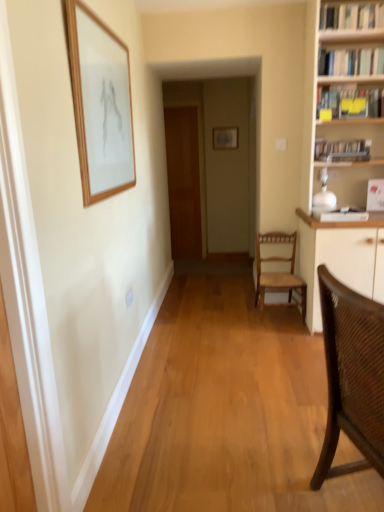
Question: Does hardcover books at upper right, positioned as the fourth book in top-to-bottom order, appear on the left side of brown woven chair at right, which ranks as the 1th chair in front-to-back order?

Choices:
 (A) no
 (B) yes

Answer: (A)

Question: Is hardcover books at upper right, acting as the 1th book starting from the bottom, in contact with brown woven chair at right, which ranks as the 1th chair in front-to-back order?

Choices:
 (A) no
 (B) yes

Answer: (A)

Question: Can you confirm if hardcover books at upper right, acting as the 1th book starting from the bottom, is bigger than brown woven chair at right, the second chair viewed from the back?

Choices:
 (A) yes
 (B) no

Answer: (B)

Question: From a real-world perspective, is hardcover books at upper right, acting as the 1th book starting from the bottom, physically below brown woven chair at right, the second chair viewed from the back?

Choices:
 (A) yes
 (B) no

Answer: (B)

Question: From their relative heights in the image, would you say wooden picture frame at upper left, which is the 1th picture frame from left to right, is taller or shorter than matte gray picture frame at center, the second picture frame in the bottom-to-top sequence?

Choices:
 (A) tall
 (B) short

Answer: (A)

Question: Considering the relative positions of wooden picture frame at upper left, arranged as the second picture frame when viewed from the right, and matte gray picture frame at center, which is counted as the 1th picture frame, starting from the top, in the image provided, is wooden picture frame at upper left, arranged as the second picture frame when viewed from the right, to the left or to the right of matte gray picture frame at center, which is counted as the 1th picture frame, starting from the top,?

Choices:
 (A) left
 (B) right

Answer: (A)

Question: Considering the positions of point (127, 98) and point (223, 137), is point (127, 98) closer or farther from the camera than point (223, 137)?

Choices:
 (A) closer
 (B) farther

Answer: (A)

Question: In terms of size, does wooden picture frame at upper left, which is the 1th picture frame from left to right, appear bigger or smaller than matte gray picture frame at center, which is the 2th picture frame in left-to-right order?

Choices:
 (A) small
 (B) big

Answer: (B)

Question: In the image, is white glossy bookshelf at upper right, which ranks as the fourth book in bottom-to-top order, on the left side or the right side of hardcover books at upper right, acting as the 1th book starting from the bottom?

Choices:
 (A) left
 (B) right

Answer: (A)

Question: Which is correct: white glossy bookshelf at upper right, which ranks as the fourth book in bottom-to-top order, is inside hardcover books at upper right, acting as the 1th book starting from the bottom, or outside of it?

Choices:
 (A) outside
 (B) inside

Answer: (A)

Question: From a real-world perspective, is white glossy bookshelf at upper right, which ranks as the fourth book in bottom-to-top order, physically located above or below hardcover books at upper right, acting as the 1th book starting from the bottom?

Choices:
 (A) above
 (B) below

Answer: (A)

Question: Is white glossy bookshelf at upper right, which appears as the first book when viewed from the top, wider or thinner than hardcover books at upper right, acting as the 1th book starting from the bottom?

Choices:
 (A) thin
 (B) wide

Answer: (B)

Question: Is matte gray picture frame at center, marked as the first picture frame in a back-to-front arrangement, wider or thinner than white glossy bookshelf at upper right, which appears as the first book when viewed from the top?

Choices:
 (A) thin
 (B) wide

Answer: (A)

Question: Does point (213, 133) appear closer or farther from the camera than point (327, 27)?

Choices:
 (A) closer
 (B) farther

Answer: (B)